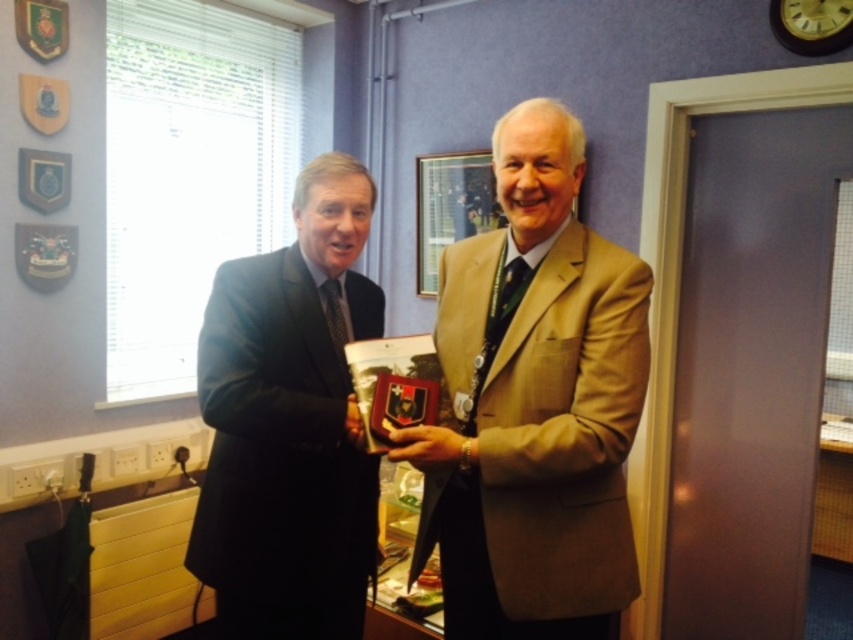
You are standing in the office scene described. There is a point at coordinates (534, 404). What object is located at this point?

The point at coordinates (534, 404) corresponds to the light brown textured suit at center.

You are organizing a photo shoot and need to ensure that the light brown textured suit at center and the dark blue suit at left are visible in the final image. Based on their positions, which suit is more likely to be fully visible in the photo?

The light brown textured suit at center is positioned over dark blue suit at left, so the light brown textured suit at center is more likely to be fully visible in the photo.

You are organizing a photo shoot and need to arrange two models wearing the light brown textured suit at center and dark blue suit at left. According to the scene description, which model should stand to the right side when facing the camera?

The light brown textured suit at center should stand to the right side because it is positioned on the right side of the dark blue suit at left.